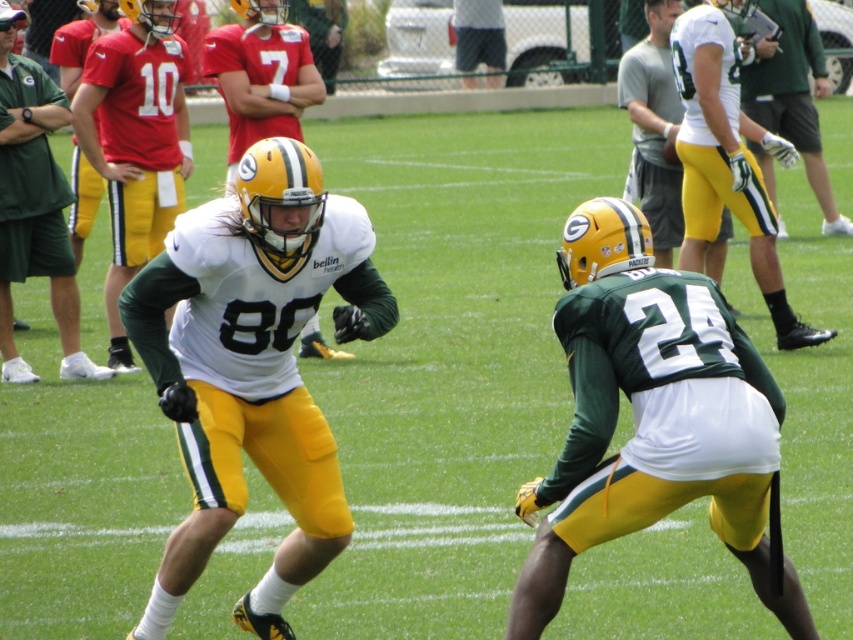
You are a referee observing the football practice. You notice the white matte jersey at upper right and the matte green helmet at left. Which object is positioned higher in the image?

The white matte jersey at upper right is located above the matte green helmet at left, so it is positioned higher in the image.

You are a photographer standing at the edge of the field taking pictures of the football practice. You notice two points marked in the image at coordinates point (689, 56) and point (831, 225). Which point is closer to your camera?

Point (689, 56) is closer to the camera than point (831, 225).

You are a coach analyzing the play. The white matte jersey at upper right is at coordinates point (x=724, y=163). Where is the white matte jersey at upper right located in the field?

The white matte jersey at upper right is located at coordinates point (x=724, y=163).